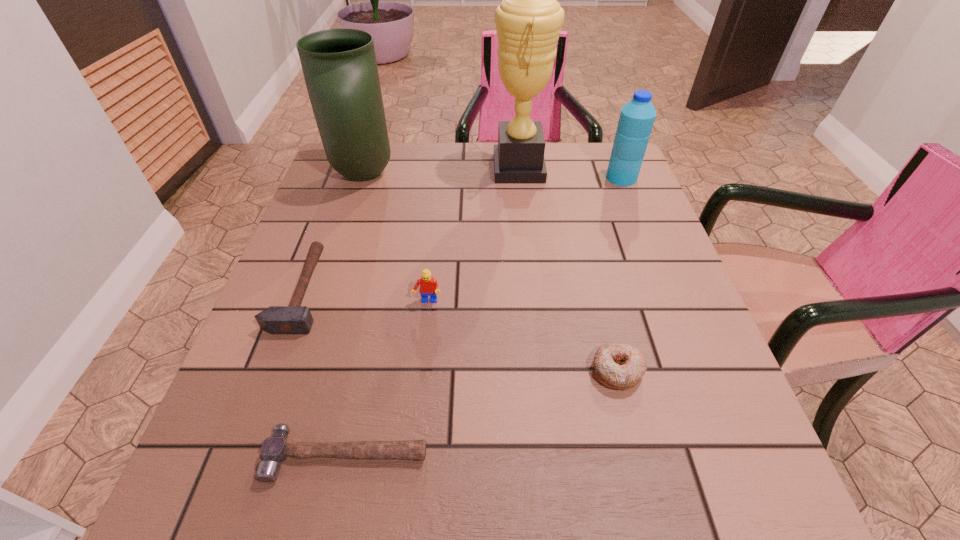
This screenshot has width=960, height=540. In order to click on vase present at the far edge in this screenshot , I will do `click(339, 66)`.

Locate an element on the screen. The height and width of the screenshot is (540, 960). water bottle that is positioned at the far edge is located at coordinates (637, 116).

Where is `object present at the near edge`? The height and width of the screenshot is (540, 960). object present at the near edge is located at coordinates (275, 449).

Where is `vase located at the left edge`? The width and height of the screenshot is (960, 540). vase located at the left edge is located at coordinates (339, 66).

The height and width of the screenshot is (540, 960). Find the location of `water bottle that is at the right edge`. water bottle that is at the right edge is located at coordinates (637, 116).

The image size is (960, 540). Find the location of `doughnut located at the right edge`. doughnut located at the right edge is located at coordinates (617, 365).

Where is `object that is at the far left corner`? This screenshot has width=960, height=540. object that is at the far left corner is located at coordinates (339, 66).

Where is `object positioned at the near left corner`? The width and height of the screenshot is (960, 540). object positioned at the near left corner is located at coordinates (x=275, y=449).

You are a GUI agent. You are given a task and a screenshot of the screen. Output one action in this format:
    pyautogui.click(x=<x>, y=<y>)
    Task: Click on the object situated at the far right corner
    
    Given the screenshot: What is the action you would take?
    pyautogui.click(x=637, y=116)

Locate an element on the screen. vacant space at the far edge of the desktop is located at coordinates (419, 148).